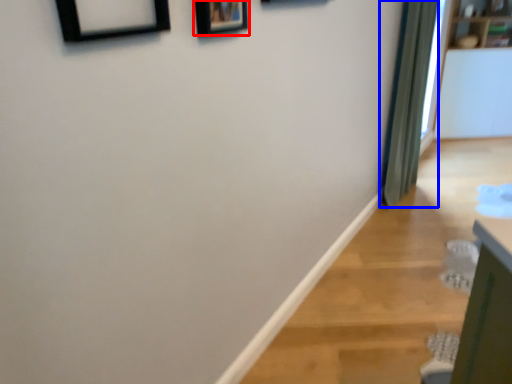
Question: Which object appears farthest to the camera in this image, picture frame (highlighted by a red box) or curtain (highlighted by a blue box)?

Choices:
 (A) picture frame
 (B) curtain

Answer: (B)